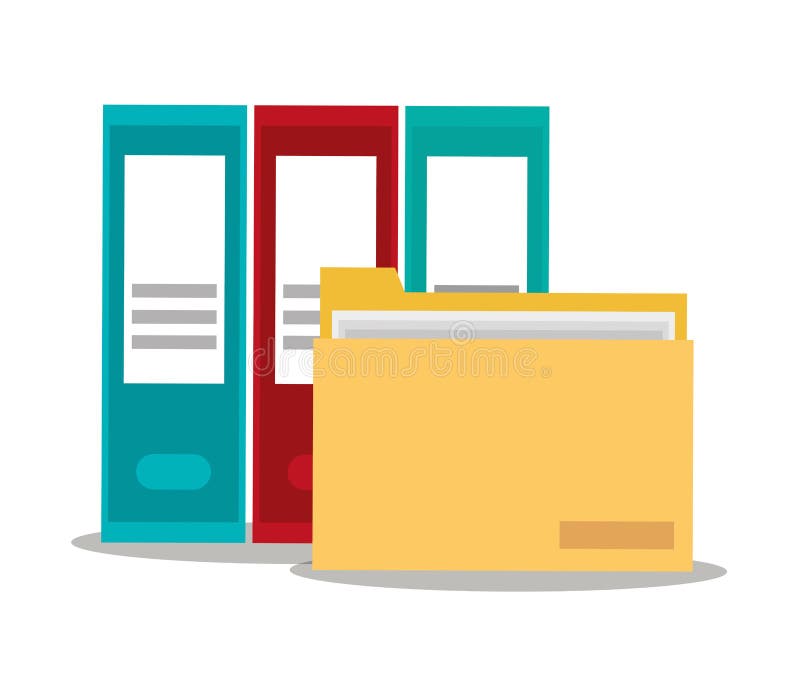
Image resolution: width=800 pixels, height=697 pixels. Find the location of `teal book on the right`. teal book on the right is located at coordinates (480, 144).